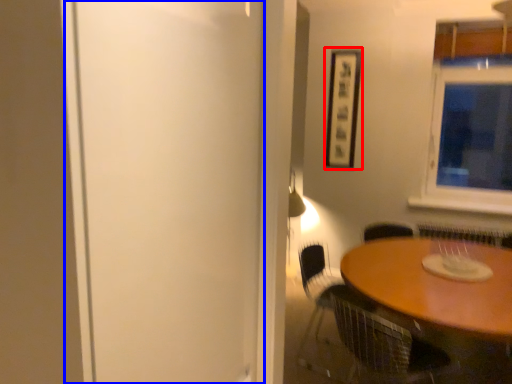
Question: Which point is closer to the camera, picture frame (highlighted by a red box) or screen door (highlighted by a blue box)?

Choices:
 (A) picture frame
 (B) screen door

Answer: (B)